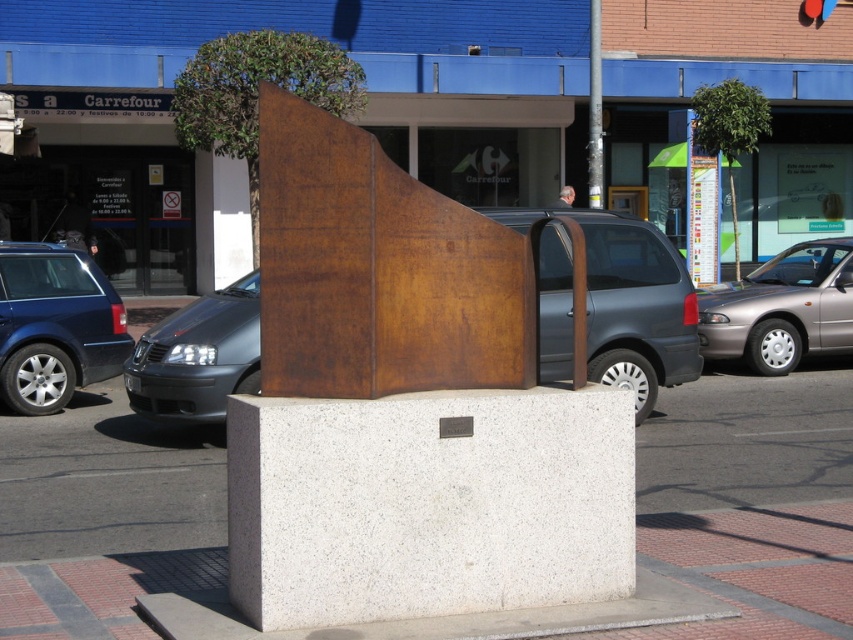
Question: Is matte brown van at center closer to the viewer compared to matte black car at left?

Choices:
 (A) no
 (B) yes

Answer: (A)

Question: Which point is closer to the camera taking this photo?

Choices:
 (A) (622, 321)
 (B) (231, 291)
 (C) (589, 189)
 (D) (22, 396)

Answer: (A)

Question: Considering the relative positions of matte blue car at left and copper metal pole at center in the image provided, where is matte blue car at left located with respect to copper metal pole at center?

Choices:
 (A) right
 (B) left

Answer: (B)

Question: Estimate the real-world distances between objects in this image. Which object is closer to the matte brown van at center?

Choices:
 (A) matte blue car at left
 (B) silver metallic car at right
 (C) matte black car at left

Answer: (C)

Question: Which point is closer to the camera?

Choices:
 (A) (91, 355)
 (B) (143, 364)
 (C) (428, 348)

Answer: (C)

Question: Does rusty metal sculpture at center lie in front of silver metallic car at right?

Choices:
 (A) yes
 (B) no

Answer: (A)